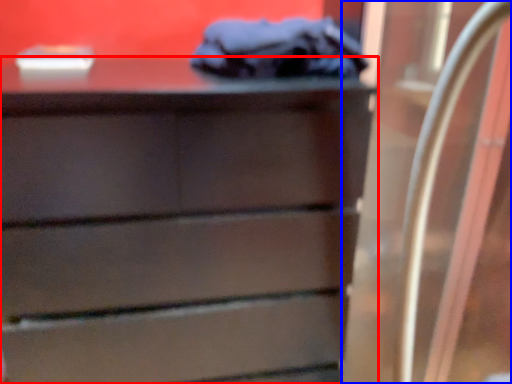
Question: Which object is further to the camera taking this photo, chest of drawers (highlighted by a red box) or glass door (highlighted by a blue box)?

Choices:
 (A) chest of drawers
 (B) glass door

Answer: (A)